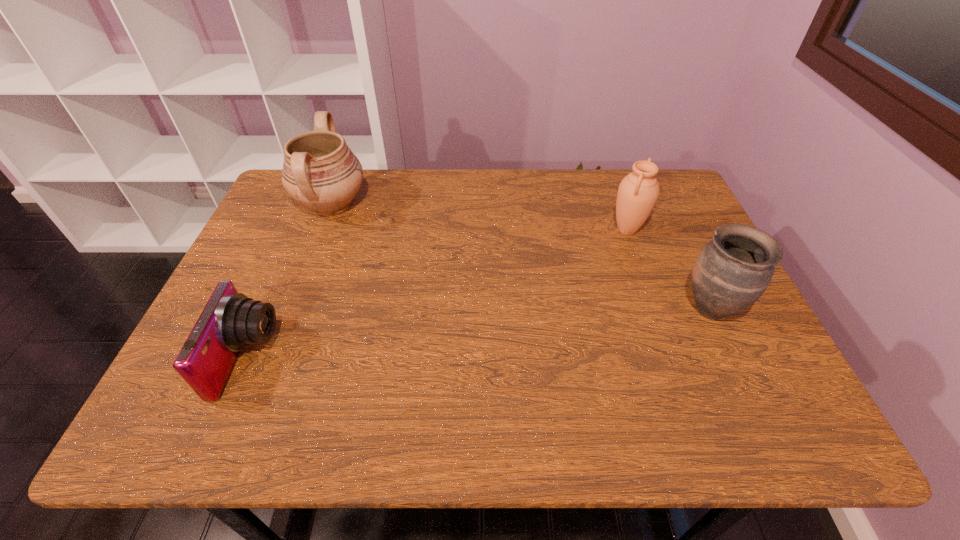
You are a GUI agent. You are given a task and a screenshot of the screen. Output one action in this format:
    pyautogui.click(x=<x>, y=<y>)
    Task: Click on the vacant space that's between the shortest object and the second urn from left to right
    Image resolution: width=960 pixels, height=540 pixels.
    Given the screenshot: What is the action you would take?
    pyautogui.click(x=438, y=294)

Find the location of a particular element. The width and height of the screenshot is (960, 540). vacant space in between the leftmost urn and the rightmost urn is located at coordinates (521, 256).

Find the location of a particular element. The image size is (960, 540). empty space that is in between the second urn from left to right and the rightmost urn is located at coordinates (669, 269).

You are a GUI agent. You are given a task and a screenshot of the screen. Output one action in this format:
    pyautogui.click(x=<x>, y=<y>)
    Task: Click on the unoccupied area between the shortest object and the leftmost urn
    
    Given the screenshot: What is the action you would take?
    pyautogui.click(x=290, y=282)

What are the coordinates of `free space between the third object from left to right and the leftmost urn` in the screenshot? It's located at tap(479, 217).

Where is `free space between the leftmost urn and the nearest urn`? This screenshot has height=540, width=960. free space between the leftmost urn and the nearest urn is located at coordinates (521, 256).

You are a GUI agent. You are given a task and a screenshot of the screen. Output one action in this format:
    pyautogui.click(x=<x>, y=<y>)
    Task: Click on the free spot between the camera and the second urn from left to right
    The image size is (960, 540).
    Given the screenshot: What is the action you would take?
    pyautogui.click(x=438, y=294)

The height and width of the screenshot is (540, 960). What are the coordinates of `vacant space that is in between the camera and the nearest urn` in the screenshot? It's located at (479, 334).

At what (x,y) coordinates should I click in order to perform the action: click on vacant space that's between the leftmost urn and the nearest urn. Please return your answer as a coordinate pair (x, y). Looking at the image, I should click on (521, 256).

This screenshot has height=540, width=960. Identify the location of free point between the camera and the second object from right to left. (438, 294).